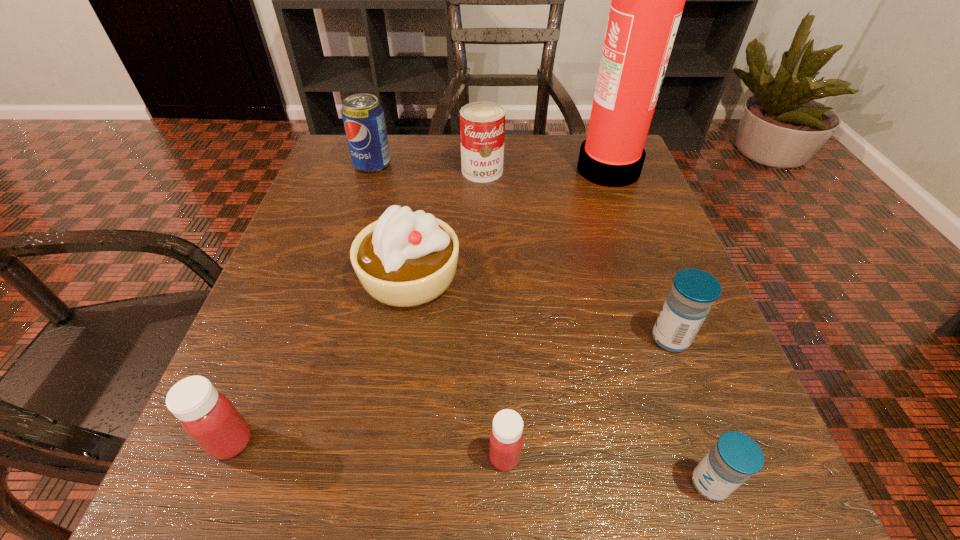
Identify the location of free spot located 0.290m on the back of the bigger red medicine. This screenshot has width=960, height=540. (302, 266).

Locate an element on the screen. The height and width of the screenshot is (540, 960). vacant region located 0.080m on the back of the right red medicine is located at coordinates (502, 385).

At what (x,y) coordinates should I click in order to perform the action: click on free space located 0.260m on the left of the nearer blue medicine. Please return your answer as a coordinate pair (x, y). Looking at the image, I should click on (469, 484).

At what (x,y) coordinates should I click in order to perform the action: click on fire extinguisher that is at the far edge. Please return your answer as a coordinate pair (x, y). The width and height of the screenshot is (960, 540). Looking at the image, I should click on (647, 2).

This screenshot has width=960, height=540. In order to click on soda positioned at the far edge in this screenshot , I will do 363,116.

The height and width of the screenshot is (540, 960). Find the location of `can that is at the far edge`. can that is at the far edge is located at coordinates (482, 124).

The height and width of the screenshot is (540, 960). What are the coordinates of `soda positioned at the left edge` in the screenshot? It's located at (363, 116).

Where is `whipped cream positioned at the left edge`? The height and width of the screenshot is (540, 960). whipped cream positioned at the left edge is located at coordinates (405, 258).

Identify the location of medicine present at the left edge. (208, 417).

At what (x,y) coordinates should I click in order to perform the action: click on fire extinguisher that is at the right edge. Please return your answer as a coordinate pair (x, y). The image size is (960, 540). Looking at the image, I should click on (647, 2).